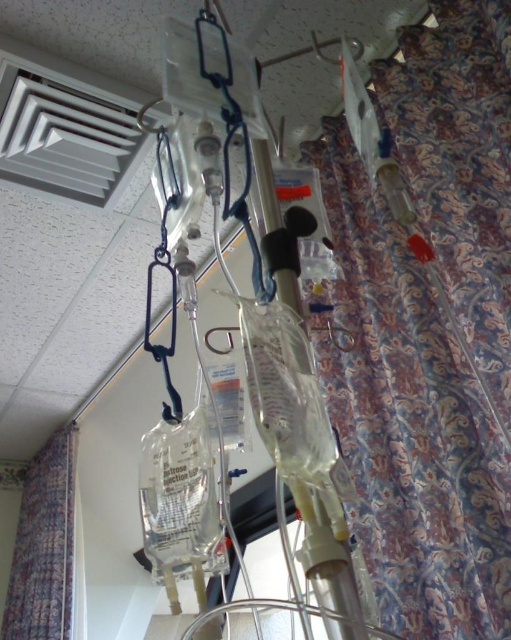
In the scene shown: You are a nurse in a hospital room and need to locate the patterned fabric curtain at right. According to the coordinates given, where would you find it?

The patterned fabric curtain at right is located at point (410, 422).

You are a nurse in a hospital room and need to locate the patterned fabric curtain at right and the patterned fabric curtain at left. Based on their positions, which curtain is closer to the entrance of the room?

The patterned fabric curtain at left is closer to the entrance because the patterned fabric curtain at right is to the right of it, meaning the left curtain is positioned nearer to where you are standing, assuming the entrance is on the left side of the room.

You are a nurse in a hospital room and need to locate two specific points marked on the floor. The first point is at coordinate point(396, 289) and the second is at point(62, 472). From your current position, which point is closer to you?

Point(396, 289) is in front of point(62, 472), so the first point is closer to you.